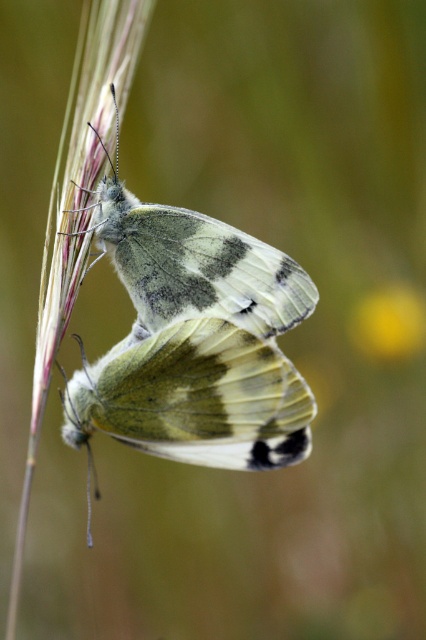
Consider the image. You are a photographer holding a camera with a 200mm lens. You want to capture a closeup of the translucent green wings at center. If you are currently 1.32 meters away from the wings, will the 200mm lens allow you to fill the frame with the wings?

The photographer is 1.32 meters away from the translucent green wings at center, which matches the minimum focusing distance required for the 200mm lens to fill the frame. Therefore, the 200mm lens can be used at this distance to capture a closeup that fills the frame with the translucent green wings at center.

You are a botanist examining the plant in the image. You notice a translucent green wings at center and a yellow matte flower at upper right. Which object is located to the right of the other?

The yellow matte flower at upper right is located to the right of the translucent green wings at center.

You are standing 5 feet away from the plant stem where the two butterflies are resting. There is a specific point at coordinates point (252, 326) that you want to reach. Can you safely approach that point without getting too close to the butterflies?

The distance of point (252, 326) from viewer is 4.71 feet, so since you are currently 5 feet away, you can move closer to the point (252, 326) as it is 0.29 feet closer than your current position. This should be safe as long as you approach carefully.